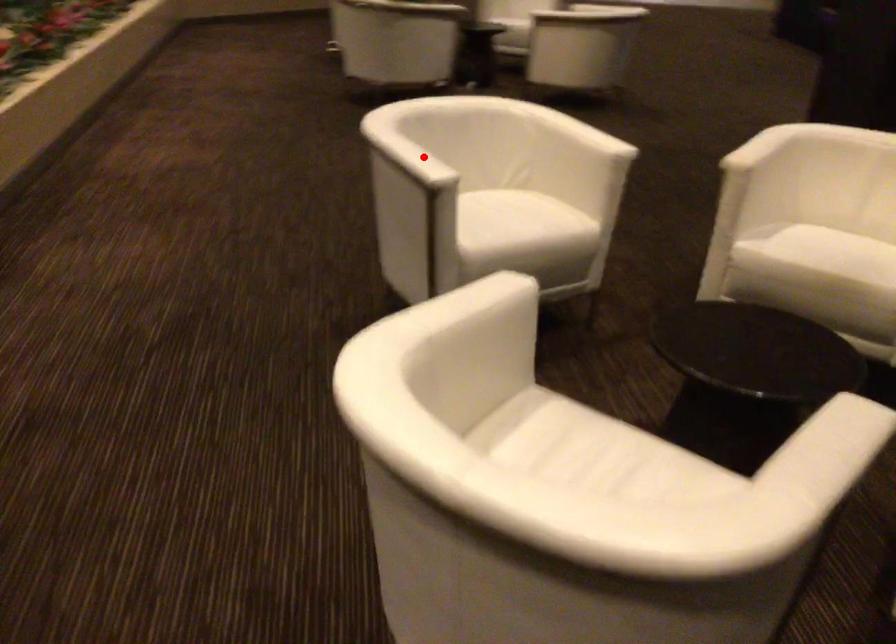
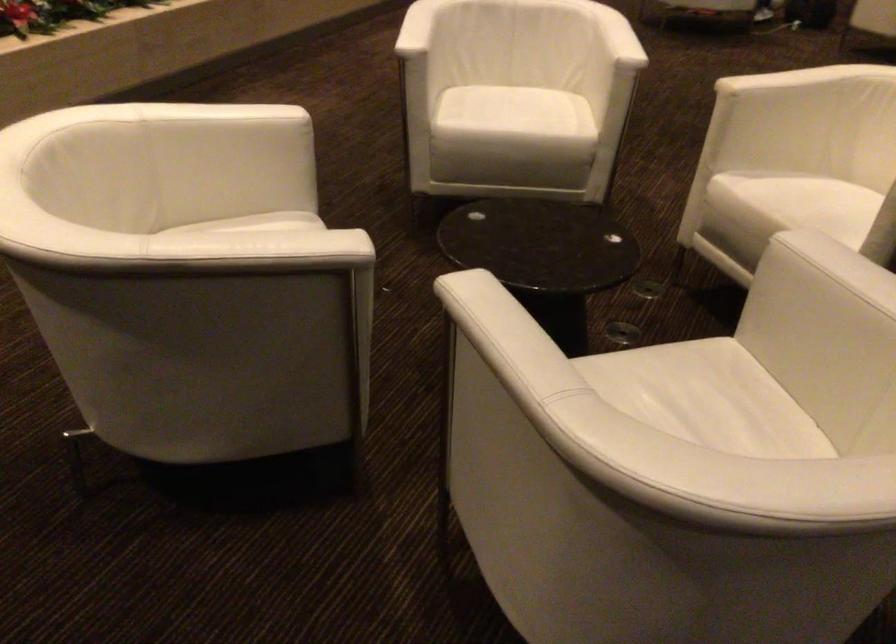
Question: I am providing you with two images of the same scene from different viewpoints. A red point is shown in image1. For the corresponding object point in image2, is it positioned nearer or farther from the camera?

Choices:
 (A) Nearer
 (B) Farther

Answer: (B)